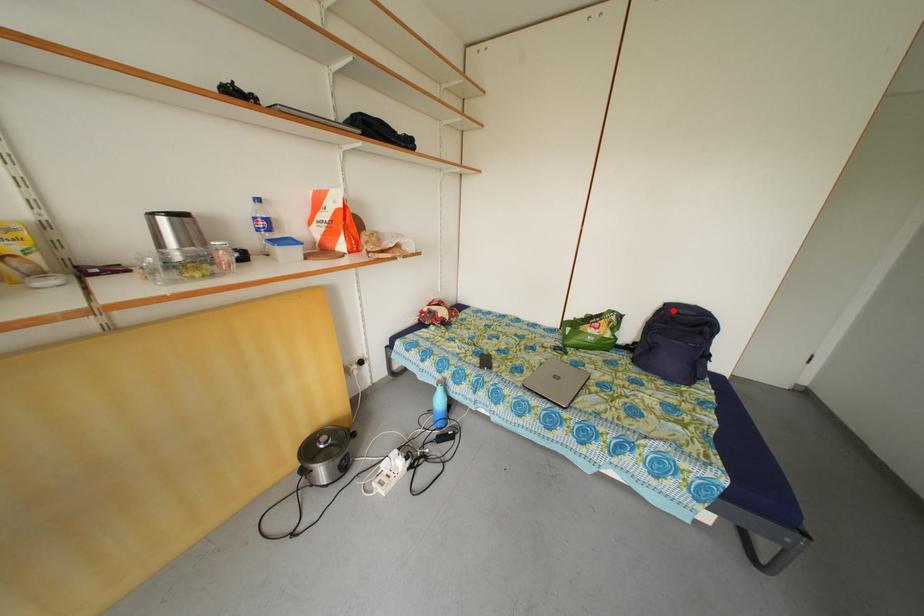
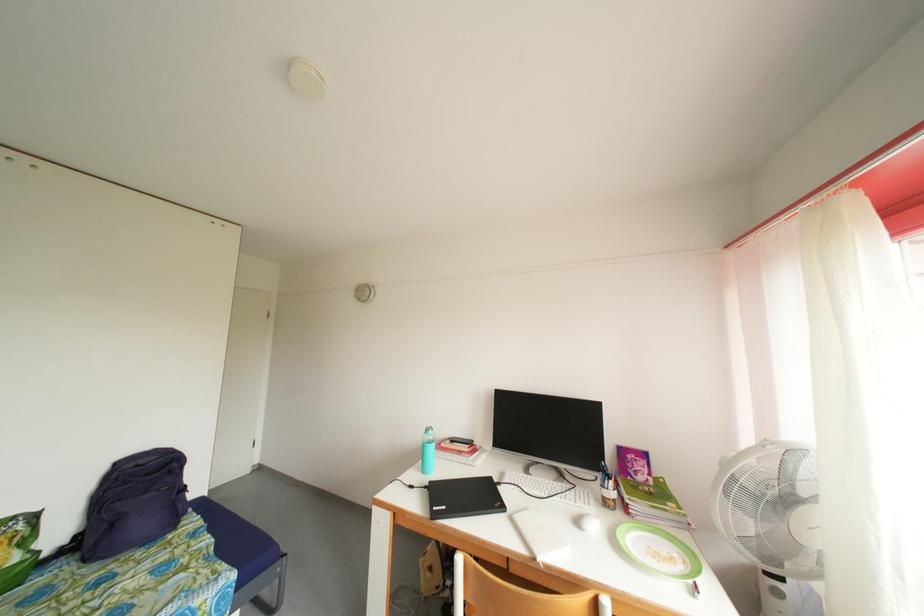
Where in the second image is the point corresponding to the highlighted location from the first image?

(124, 469)